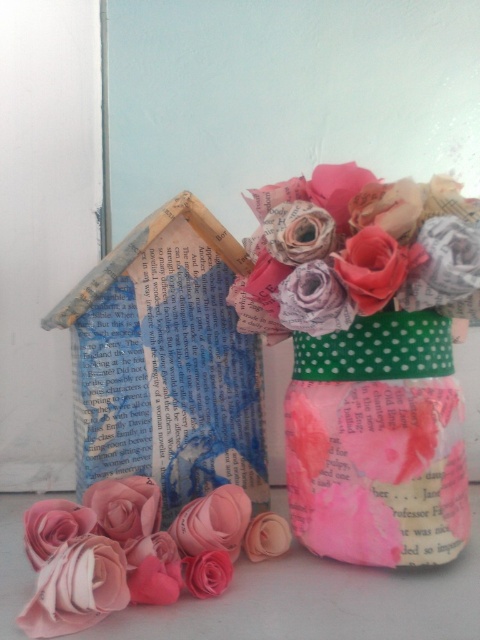
Question: Does matte paper flower at center appear over pink paper flower at lower left?

Choices:
 (A) yes
 (B) no

Answer: (A)

Question: Does matte paper flower at center appear over pink paper flower at lower left?

Choices:
 (A) no
 (B) yes

Answer: (B)

Question: Which point is closer to the camera?

Choices:
 (A) (448, 307)
 (B) (82, 625)

Answer: (B)

Question: Does matte paper flower at center come behind pink paper flower at lower left?

Choices:
 (A) yes
 (B) no

Answer: (A)